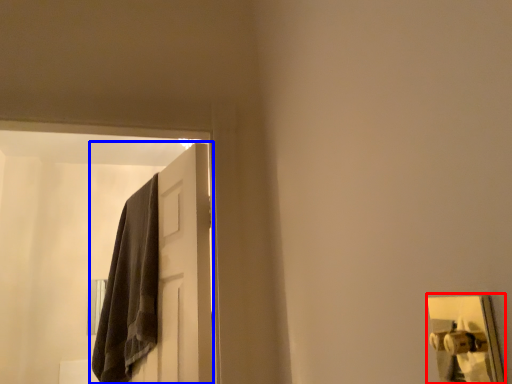
Question: Which point is closer to the camera, door handle (highlighted by a red box) or door (highlighted by a blue box)?

Choices:
 (A) door handle
 (B) door

Answer: (A)